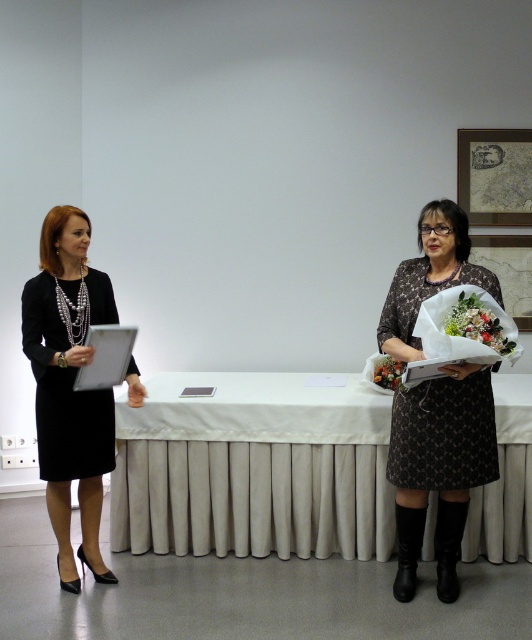
Question: Is white cloth-covered table at center in front of fluffy floral bouquet at right?

Choices:
 (A) yes
 (B) no

Answer: (B)

Question: Among these points, which one is farthest from the camera?

Choices:
 (A) (453, 304)
 (B) (437, 529)
 (C) (421, 220)

Answer: (B)

Question: Does fluffy floral bouquet at right appear over fluffy bouquet at right?

Choices:
 (A) no
 (B) yes

Answer: (B)

Question: Which object is closer to the camera taking this photo?

Choices:
 (A) fluffy floral bouquet at right
 (B) fluffy bouquet at right
 (C) patterned fabric dress at right

Answer: (A)

Question: Which object appears farthest from the camera in this image?

Choices:
 (A) black leather boot at lower right
 (B) fluffy floral bouquet at right
 (C) black matte dress at left
 (D) patterned fabric dress at right

Answer: (A)

Question: Does patterned fabric dress at right appear under fluffy floral bouquet at right?

Choices:
 (A) yes
 (B) no

Answer: (A)